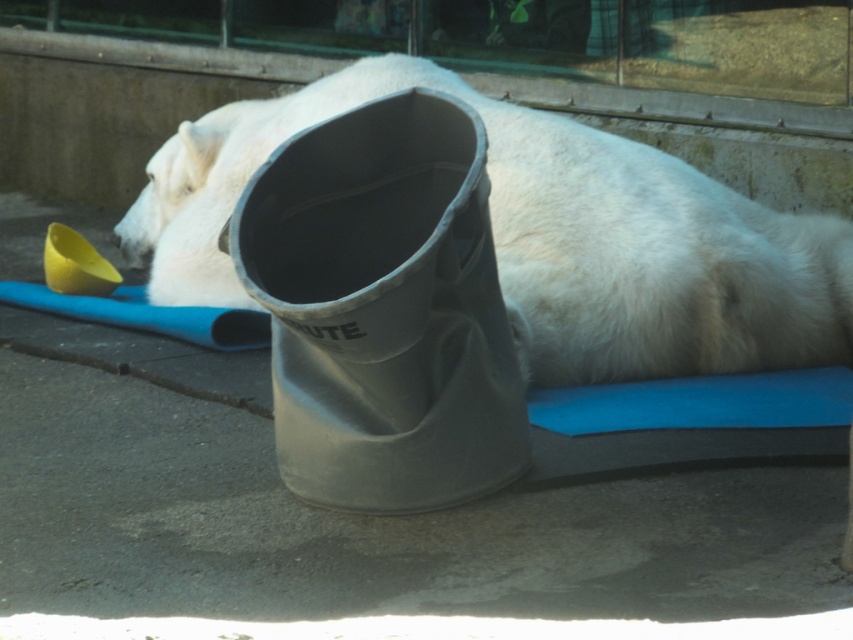
Question: Which point is closer to the camera?

Choices:
 (A) (669, 253)
 (B) (471, 468)

Answer: (B)

Question: Is the position of white matte polar bear at center less distant than that of matte gray boot at center?

Choices:
 (A) yes
 (B) no

Answer: (B)

Question: Can you confirm if white matte polar bear at center is positioned above matte gray boot at center?

Choices:
 (A) yes
 (B) no

Answer: (A)

Question: Is white matte polar bear at center further to camera compared to matte gray boot at center?

Choices:
 (A) no
 (B) yes

Answer: (B)